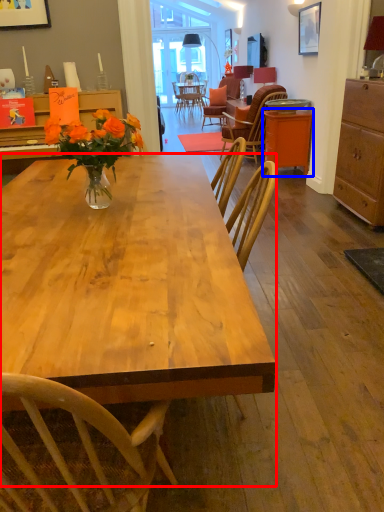
Question: Among these objects, which one is farthest to the camera, desk (highlighted by a red box) or table (highlighted by a blue box)?

Choices:
 (A) desk
 (B) table

Answer: (B)